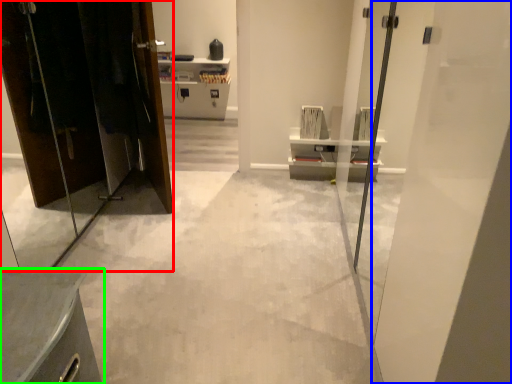
Question: Estimate the real-world distances between objects in this image. Which object is closer to elevator (highlighted by a red box), door (highlighted by a blue box) or furniture (highlighted by a green box)?

Choices:
 (A) door
 (B) furniture

Answer: (B)